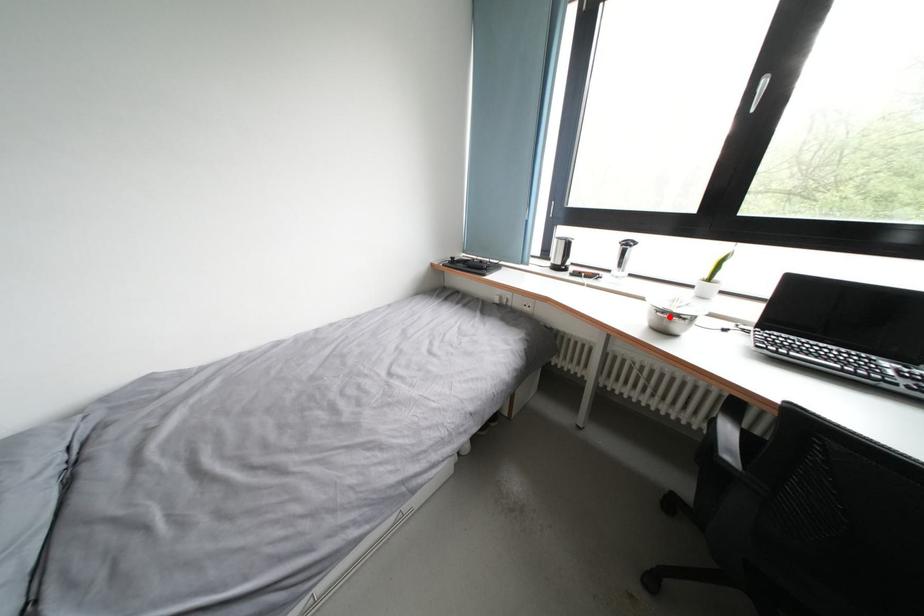
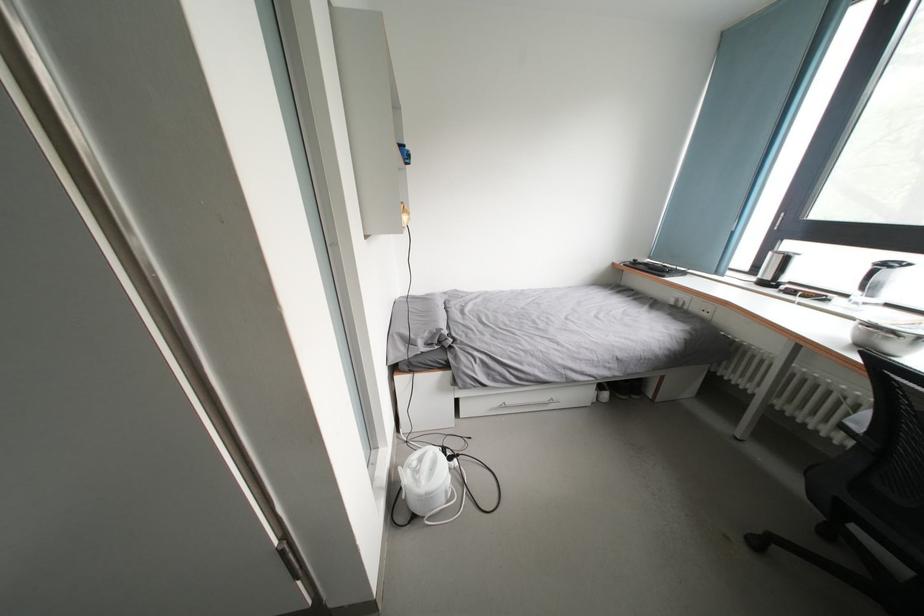
Question: I am providing you with two images of the same scene from different viewpoints. A red point is marked on the first image. Can you still see the location of the red point in image 2?

Choices:
 (A) Yes
 (B) No

Answer: (A)